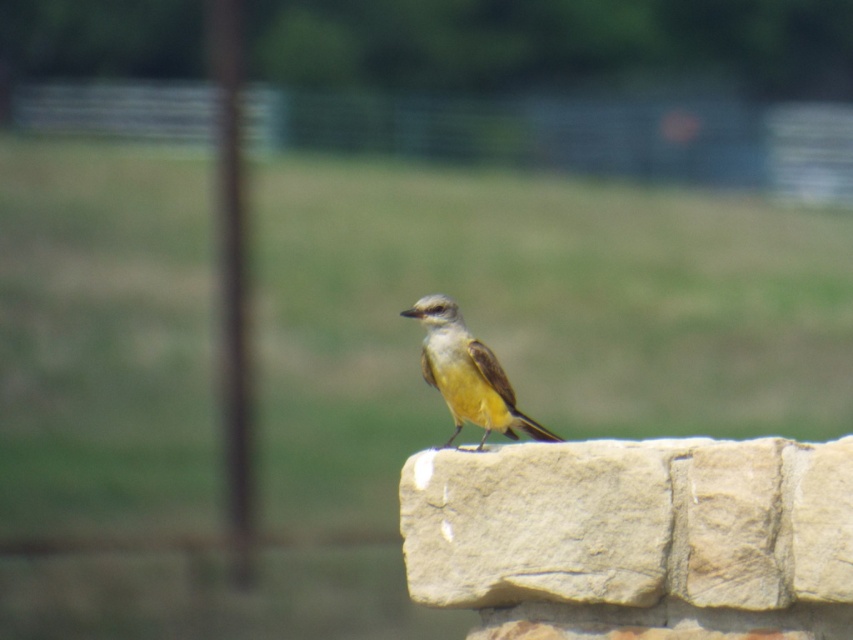
Does beige rough stone at center appear over yellow matte bird at center?

Actually, beige rough stone at center is below yellow matte bird at center.

Between beige rough stone at center and yellow matte bird at center, which one is positioned lower?

beige rough stone at center

Does point (485, 474) lie behind point (440, 321)?

No.

Locate an element on the screen. This screenshot has height=640, width=853. beige rough stone at center is located at coordinates (634, 538).